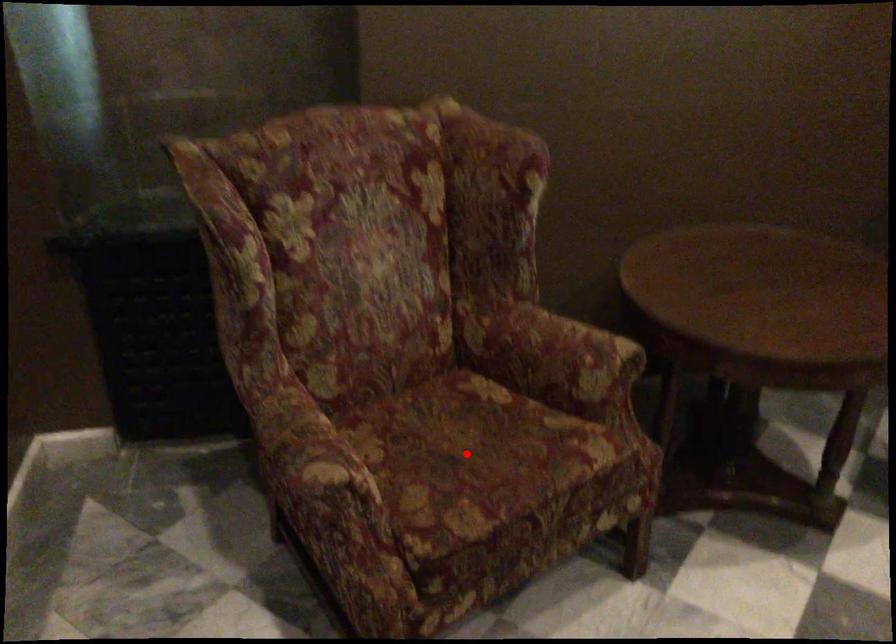
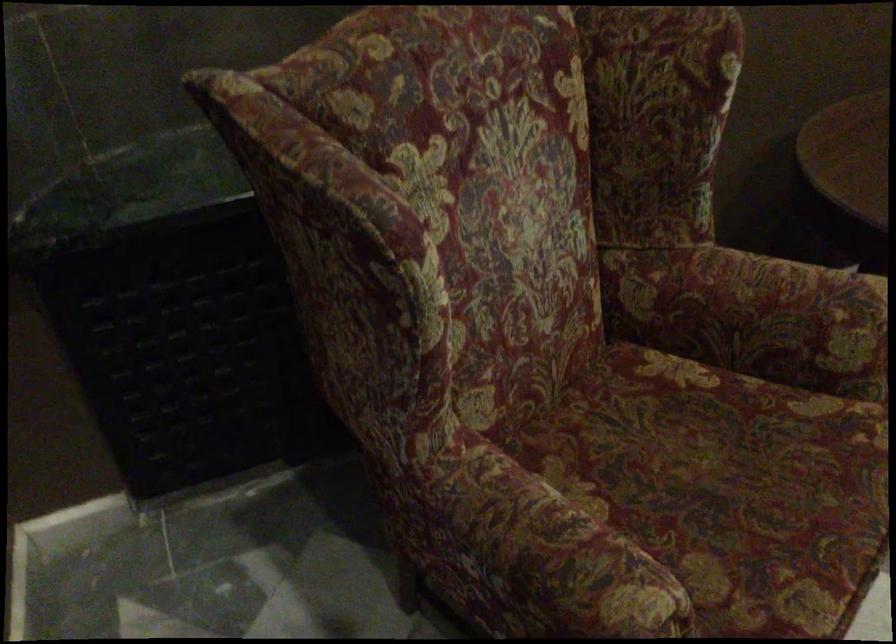
Where in the second image is the point corresponding to the highlighted location from the first image?

(726, 486)